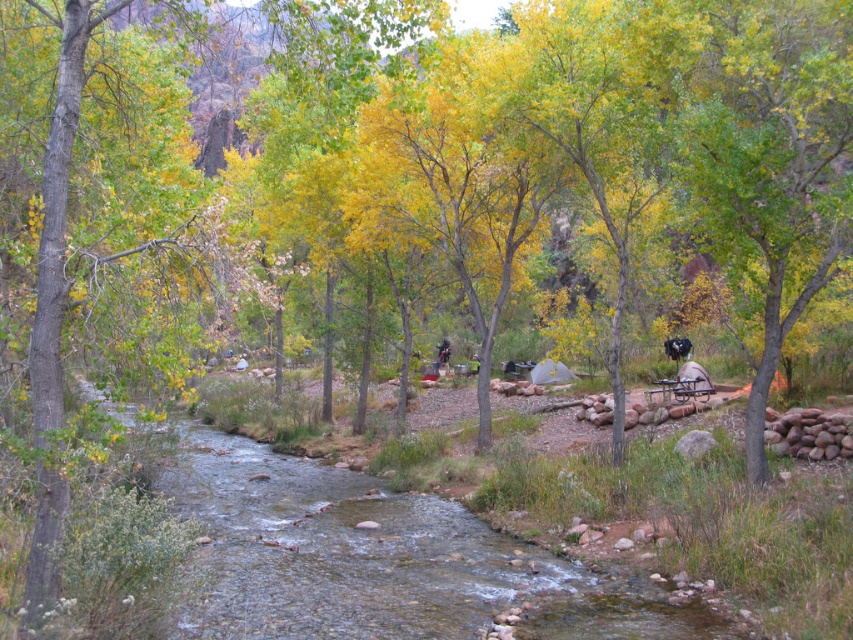
Is point (521, 634) farther from camera compared to point (448, 356)?

No, it is in front of (448, 356).

Between clear water stream at center and dark blue jeans at center, which one appears on the left side from the viewer's perspective?

From the viewer's perspective, clear water stream at center appears more on the left side.

Where is `clear water stream at center`? The height and width of the screenshot is (640, 853). clear water stream at center is located at coordinates (380, 560).

This screenshot has height=640, width=853. What are the coordinates of `clear water stream at center` in the screenshot? It's located at (380, 560).